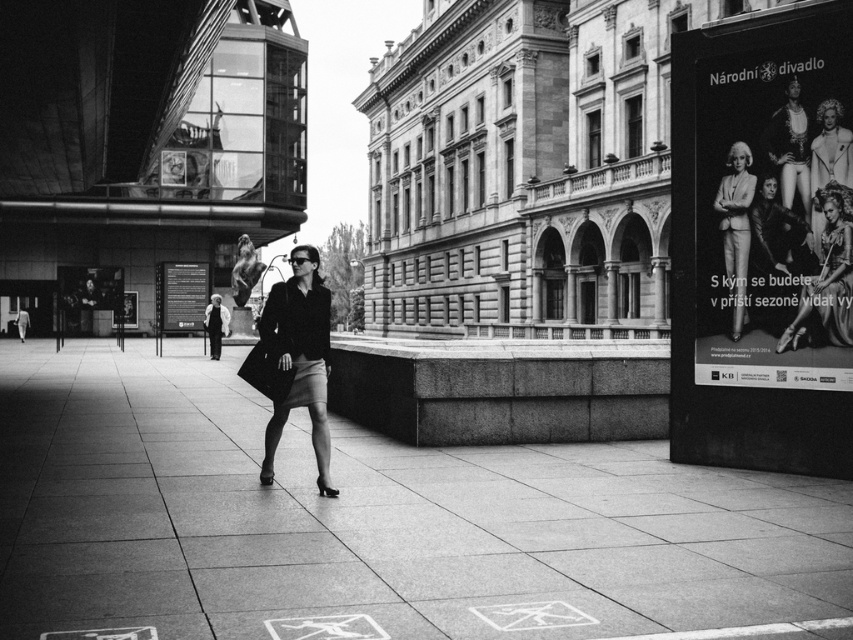
Does smooth paper poster at right have a lesser height compared to leather jacket at center?

Incorrect, smooth paper poster at right's height does not fall short of leather jacket at center's.

This screenshot has width=853, height=640. What do you see at coordinates (773, 216) in the screenshot?
I see `smooth paper poster at right` at bounding box center [773, 216].

Where is `smooth paper poster at right`? This screenshot has height=640, width=853. smooth paper poster at right is located at coordinates (773, 216).

Does smooth paper poster at right have a smaller size compared to smooth cream dress at upper right?

Incorrect, smooth paper poster at right is not smaller in size than smooth cream dress at upper right.

Describe the element at coordinates (773, 216) in the screenshot. This screenshot has width=853, height=640. I see `smooth paper poster at right` at that location.

Is point (751, 145) in front of point (815, 237)?

No, it is behind (815, 237).

The width and height of the screenshot is (853, 640). In order to click on smooth paper poster at right in this screenshot , I will do `click(773, 216)`.

Is point (764, 195) positioned in front of point (732, 250)?

Yes, point (764, 195) is closer to viewer.

Which is behind, point (775, 326) or point (753, 186)?

The point (753, 186) is more distant.

Where is `leather jacket at center`? This screenshot has height=640, width=853. leather jacket at center is located at coordinates (776, 253).